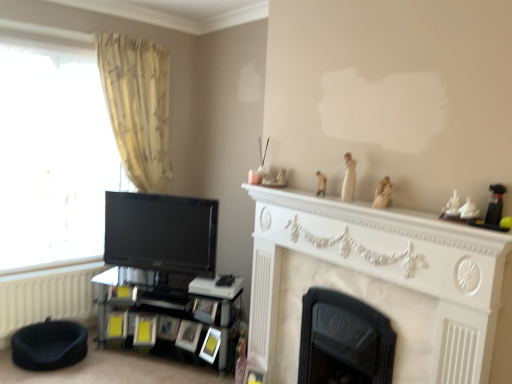
What are the coordinates of `free space that is to the left of matte white picture frame at lower center, which is counted as the 1th picture frame, starting from the left` in the screenshot? It's located at (169, 349).